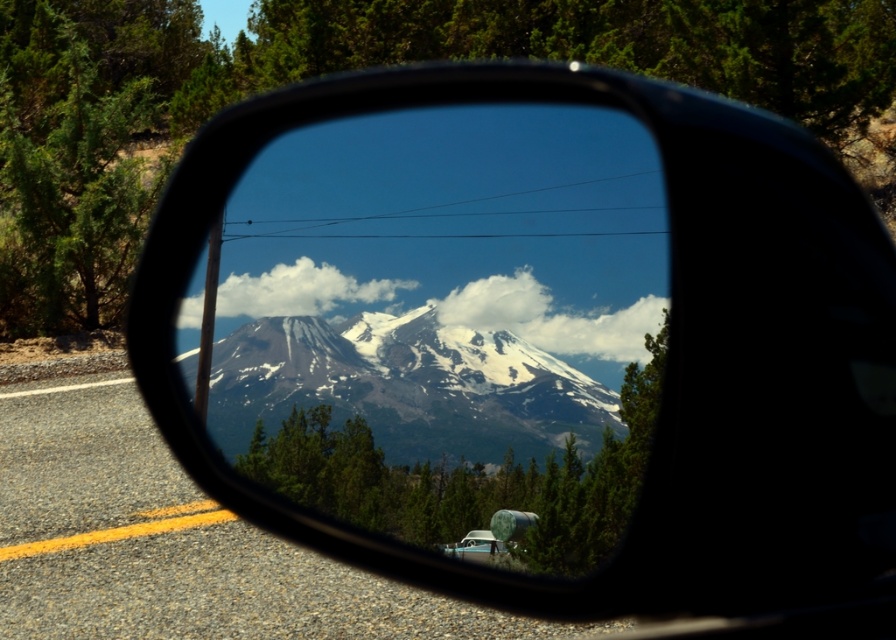
Who is positioned more to the right, snowy granite mountain at center or white matte van at center?

Positioned to the right is white matte van at center.

Which of these two, snowy granite mountain at center or white matte van at center, stands taller?

With more height is snowy granite mountain at center.

Who is more forward, (x=395, y=344) or (x=448, y=554)?

Point (x=448, y=554) is in front.

The width and height of the screenshot is (896, 640). In order to click on snowy granite mountain at center in this screenshot , I will do `click(408, 384)`.